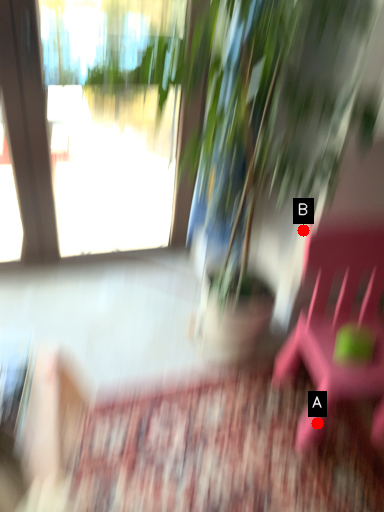
Question: Two points are circled on the image, labeled by A and B beside each circle. Which point appears closest to the camera in this image?

Choices:
 (A) A is closer
 (B) B is closer

Answer: (A)